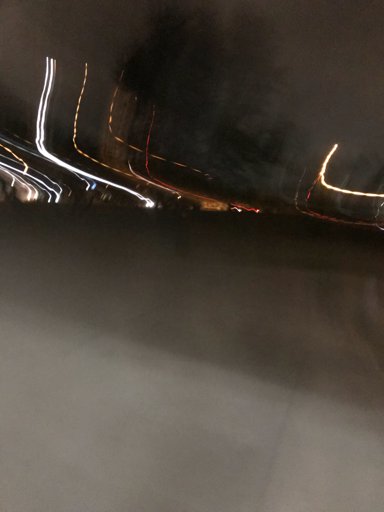
Identify the location of white light. (78, 170), (58, 192).